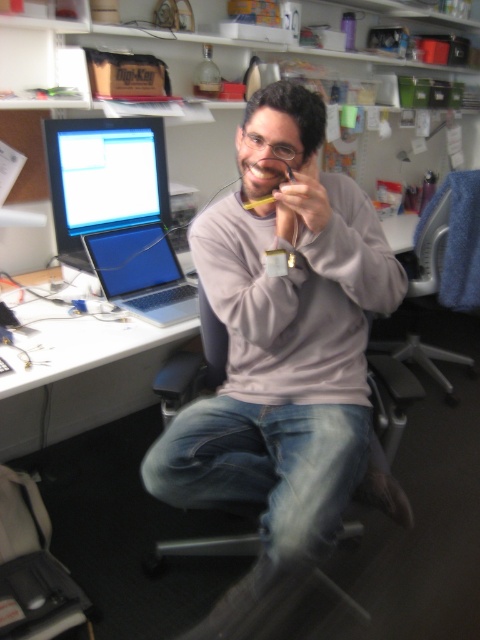
Can you confirm if matte black monitor at upper left is shorter than silver metallic laptop at left?

No, matte black monitor at upper left is not shorter than silver metallic laptop at left.

Is matte black monitor at upper left below silver metallic laptop at left?

Actually, matte black monitor at upper left is above silver metallic laptop at left.

Is point (120, 205) less distant than point (175, 260)?

That is True.

Where is `matte black monitor at upper left`? matte black monitor at upper left is located at coordinates pos(104,179).

Can you confirm if gray matte sweatshirt at center is positioned above white plastic table at center?

Yes.

Based on the photo, does gray matte sweatshirt at center come in front of white plastic table at center?

That is True.

Which is in front, point (307, 198) or point (7, 420)?

Positioned in front is point (307, 198).

Locate an element on the screen. The width and height of the screenshot is (480, 640). gray matte sweatshirt at center is located at coordinates (284, 356).

Is gray matte sweatshirt at center to the right of gray fabric swivel chair at right from the viewer's perspective?

No, gray matte sweatshirt at center is not to the right of gray fabric swivel chair at right.

Measure the distance from gray matte sweatshirt at center to gray fabric swivel chair at right.

gray matte sweatshirt at center is 1.34 meters away from gray fabric swivel chair at right.

Is point (204, 284) closer to camera compared to point (400, 349)?

Yes, it is in front of point (400, 349).

Find the location of a particular element. gray matte sweatshirt at center is located at coordinates (284, 356).